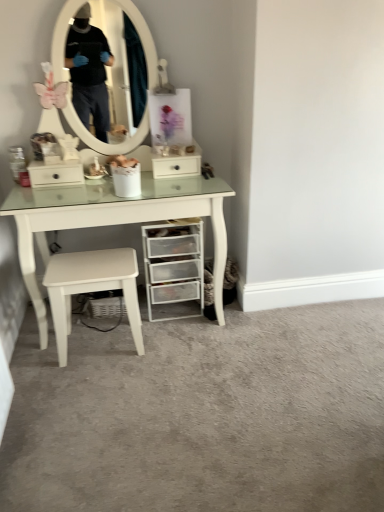
Question: Is white matte stool at lower center positioned with its back to clear plastic drawers at lower right?

Choices:
 (A) yes
 (B) no

Answer: (B)

Question: From a real-world perspective, does white matte stool at lower center sit lower than clear plastic drawers at lower right?

Choices:
 (A) no
 (B) yes

Answer: (B)

Question: Are white matte stool at lower center and clear plastic drawers at lower right located far from each other?

Choices:
 (A) yes
 (B) no

Answer: (B)

Question: Can you confirm if white matte stool at lower center is smaller than clear plastic drawers at lower right?

Choices:
 (A) no
 (B) yes

Answer: (B)

Question: Is white matte stool at lower center shorter than clear plastic drawers at lower right?

Choices:
 (A) yes
 (B) no

Answer: (A)

Question: Considering their positions, is clear plastic drawers at lower right located in front of or behind white glossy drawer at center?

Choices:
 (A) front
 (B) behind

Answer: (A)

Question: Is clear plastic drawers at lower right inside the boundaries of white glossy drawer at center, or outside?

Choices:
 (A) inside
 (B) outside

Answer: (B)

Question: In terms of height, does clear plastic drawers at lower right look taller or shorter compared to white glossy drawer at center?

Choices:
 (A) short
 (B) tall

Answer: (B)

Question: From a real-world perspective, is clear plastic drawers at lower right physically located above or below white glossy drawer at center?

Choices:
 (A) below
 (B) above

Answer: (A)

Question: Considering the positions of point (155, 182) and point (177, 164), is point (155, 182) closer or farther from the camera than point (177, 164)?

Choices:
 (A) closer
 (B) farther

Answer: (A)

Question: In terms of size, does white glossy table at center appear bigger or smaller than white glossy drawer at center?

Choices:
 (A) big
 (B) small

Answer: (A)

Question: Would you say white glossy table at center is inside or outside white glossy drawer at center?

Choices:
 (A) outside
 (B) inside

Answer: (A)

Question: From the image's perspective, is white glossy table at center located above or below white glossy drawer at center?

Choices:
 (A) above
 (B) below

Answer: (B)

Question: Considering their positions, is clear plastic drawers at lower right located in front of or behind white matte stool at lower center?

Choices:
 (A) behind
 (B) front

Answer: (A)

Question: Is clear plastic drawers at lower right inside or outside of white matte stool at lower center?

Choices:
 (A) inside
 (B) outside

Answer: (B)